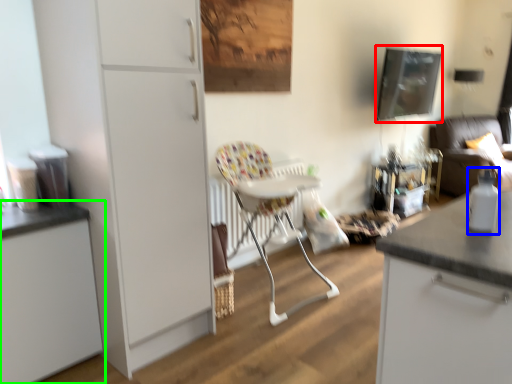
Question: Based on their relative distances, which object is farther from picture frame (highlighted by a red box)? Choose from bottle (highlighted by a blue box) and cabinetry (highlighted by a green box).

Choices:
 (A) bottle
 (B) cabinetry

Answer: (B)